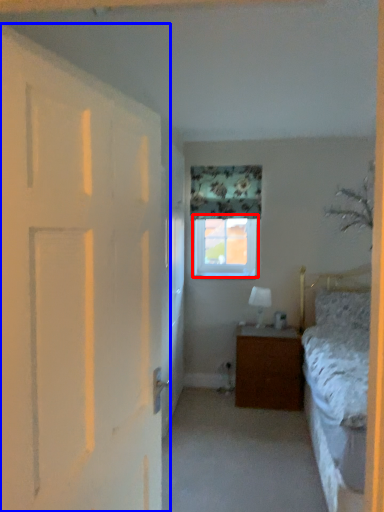
Question: Which of the following is the farthest to the observer, window (highlighted by a red box) or door (highlighted by a blue box)?

Choices:
 (A) window
 (B) door

Answer: (A)